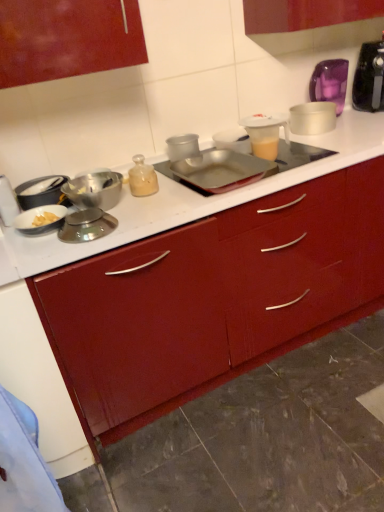
Question: Is point (213, 164) positioned closer to the camera than point (132, 182)?

Choices:
 (A) closer
 (B) farther

Answer: (B)

Question: Relative to translucent glass bottle at center, is metallic silver tray at center, placed as the sixth kitchen appliance when sorted from left to right, in front or behind?

Choices:
 (A) front
 (B) behind

Answer: (A)

Question: Based on their relative distances, which object is nearer to the translucent plastic measuring cup at upper center, which is the first appliance from front to back?

Choices:
 (A) white glossy counter at center
 (B) white plastic container at upper right, arranged as the first kitchen appliance when viewed from the right
 (C) metallic silver bowl at left, arranged as the seventh kitchen appliance when viewed from the right
 (D) metallic silver scale at center-left, acting as the 5th kitchen appliance starting from the left
 (E) translucent plastic mixer at upper right

Answer: (B)

Question: Which of these objects is positioned closest to the purple glass jar at upper right, arranged as the second appliance when viewed from the left?

Choices:
 (A) matte silver bowl at left, which ranks as the second kitchen appliance in left-to-right order
 (B) white glossy counter at center
 (C) metallic silver bowl at left, placed as the first kitchen appliance when sorted from left to right
 (D) metallic silver tray at center, placed as the sixth kitchen appliance when sorted from left to right
 (E) metallic silver scale at center-left, acting as the 5th kitchen appliance starting from the left

Answer: (D)